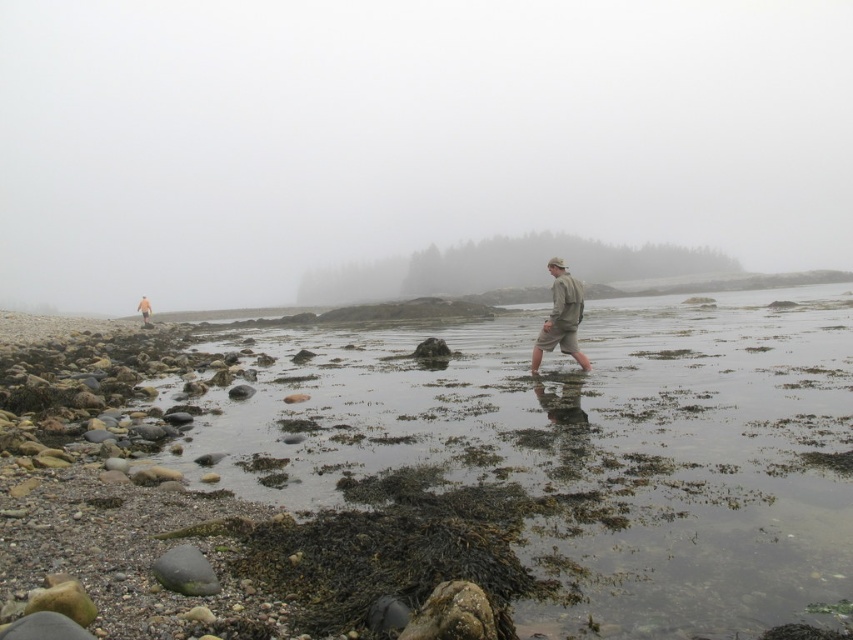
You are a photographer trying to capture the khaki fabric shorts at center in the misty coastal scene. Based on the coordinates provided, where should you focus your camera to ensure the shorts are in the center of the photo?

The khaki fabric shorts at center are located at coordinates point (561, 317), so focusing the camera at that point will center them in the photo.